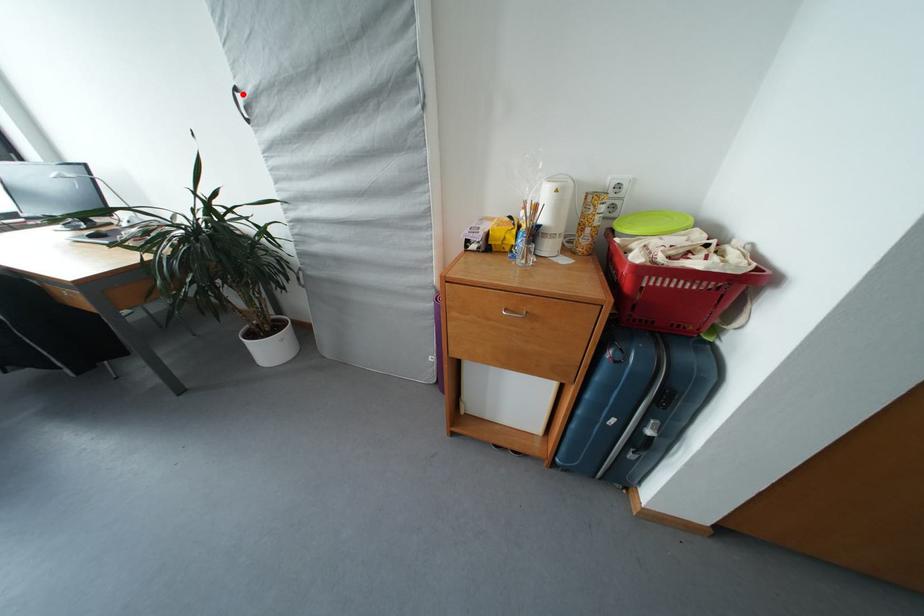
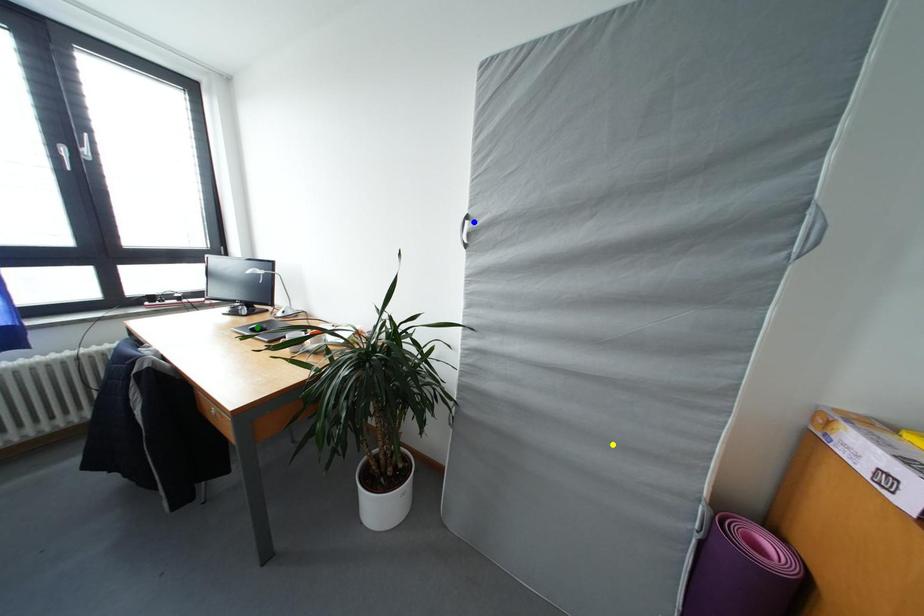
Question: I am providing you with two images of the same scene from different viewpoints. A red point is marked on the first image. You are given multiple points on the second image. Which point in image 2 represents the same 3d spot as the red point in image 1?

Choices:
 (A) blue point
 (B) green point
 (C) yellow point

Answer: (A)